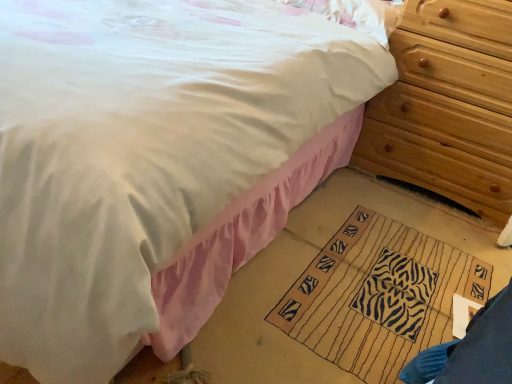
The image size is (512, 384). Find the location of `unoccupied area behind beige woven mat at lower center`. unoccupied area behind beige woven mat at lower center is located at coordinates (386, 204).